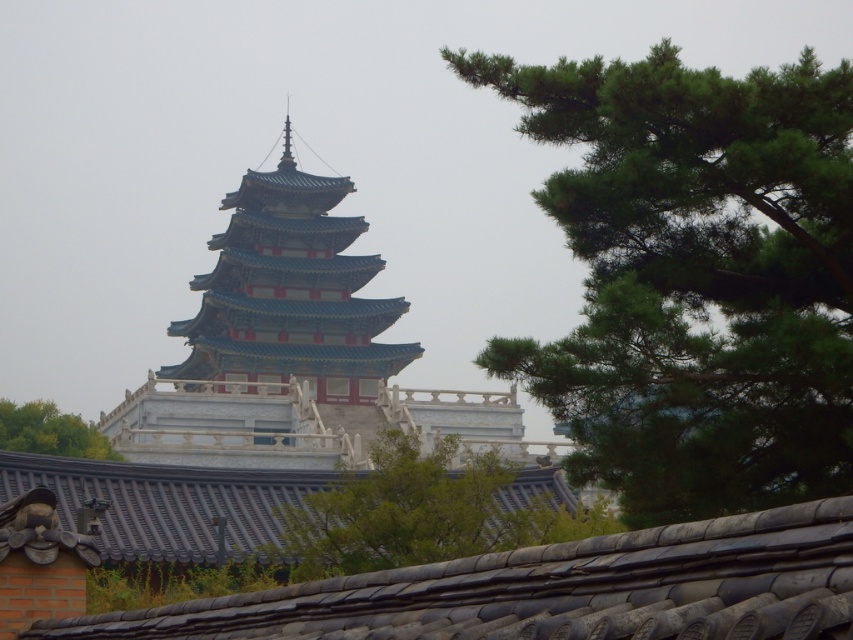
Question: Does gray tile roof at lower center appear on the right side of shiny dark gray tiles at center?

Choices:
 (A) yes
 (B) no

Answer: (A)

Question: Among these objects, which one is nearest to the camera?

Choices:
 (A) blue glazed tiles at center
 (B) gray tile roof at lower center

Answer: (B)

Question: Can you confirm if gray tile roof at lower center is positioned to the left of green leafy tree at lower left?

Choices:
 (A) no
 (B) yes

Answer: (A)

Question: Which object is closer to the camera taking this photo?

Choices:
 (A) shiny dark gray tiles at center
 (B) blue glazed tiles at center

Answer: (A)

Question: Which is farther from the green leafy tree at center?

Choices:
 (A) gray tile roof at lower center
 (B) green leafy tree at upper right
 (C) blue glazed tiles at center
 (D) green leafy tree at lower left

Answer: (C)

Question: Is blue glazed tiles at center behind shiny dark gray tiles at center?

Choices:
 (A) no
 (B) yes

Answer: (B)